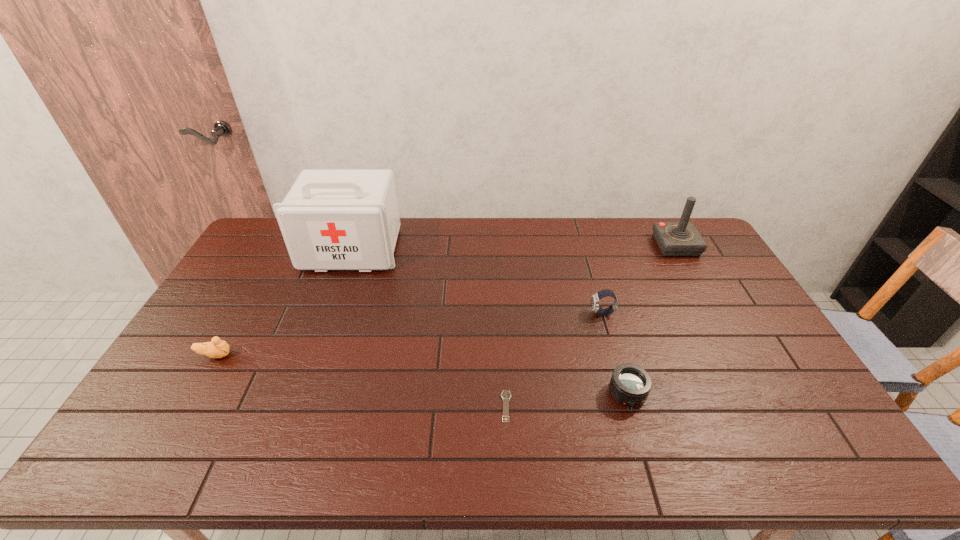
At what (x,y) coordinates should I click in order to perform the action: click on free space between the third nearest object and the second tallest object. Please return your answer as a coordinate pair (x, y). The height and width of the screenshot is (540, 960). Looking at the image, I should click on (445, 300).

Where is `free space between the telephoto lens and the joystick`? This screenshot has width=960, height=540. free space between the telephoto lens and the joystick is located at coordinates (652, 320).

Find the location of `blank region between the joystick and the third nearest object`. blank region between the joystick and the third nearest object is located at coordinates (445, 300).

Where is `free spot between the duckling and the right watch`? free spot between the duckling and the right watch is located at coordinates (409, 334).

At what (x,y) coordinates should I click in order to perform the action: click on empty location between the shortest object and the joystick. Please return your answer as a coordinate pair (x, y). Looking at the image, I should click on (591, 326).

Where is `free space between the first-aid kit and the taller watch`? The height and width of the screenshot is (540, 960). free space between the first-aid kit and the taller watch is located at coordinates (477, 281).

Find the location of a particular element. This screenshot has height=540, width=960. free spot between the second tallest object and the shorter watch is located at coordinates (591, 326).

Locate an element on the screen. Image resolution: width=960 pixels, height=540 pixels. empty space between the nearer watch and the first-aid kit is located at coordinates (429, 328).

You are a GUI agent. You are given a task and a screenshot of the screen. Output one action in this format:
    pyautogui.click(x=<x>, y=<y>)
    Task: Click on the free space between the fifth shortest object and the tallest object
    This screenshot has width=960, height=540.
    Given the screenshot: What is the action you would take?
    pyautogui.click(x=514, y=247)

Locate an element on the screen. This screenshot has height=540, width=960. object that ranks as the fifth closest to the third nearest object is located at coordinates (681, 238).